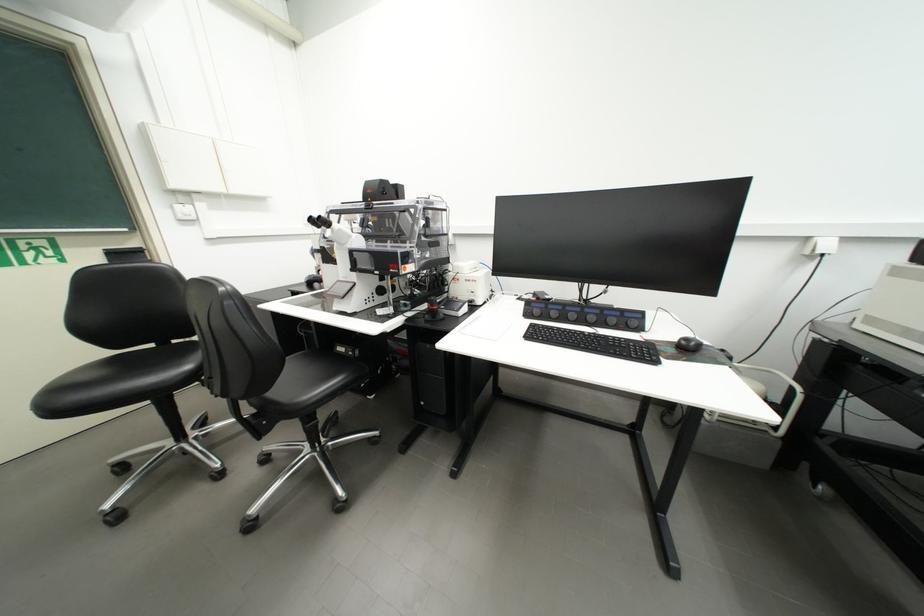
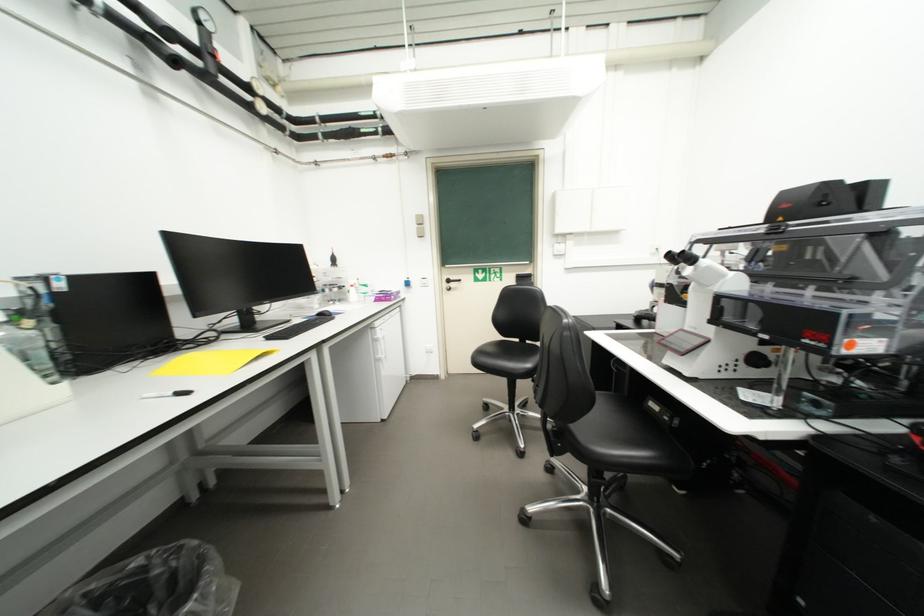
The point at (163, 209) is marked in the first image. Where is the corresponding point in the second image?

(553, 249)